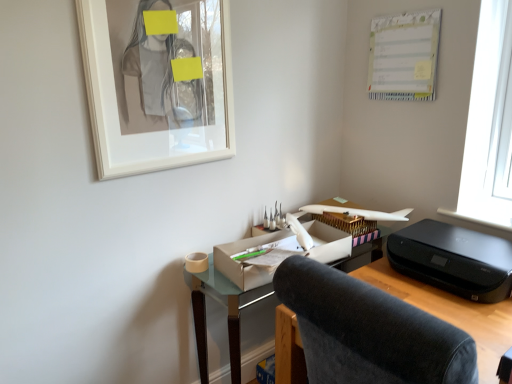
The height and width of the screenshot is (384, 512). What do you see at coordinates (404, 56) in the screenshot?
I see `white paperboard at upper right` at bounding box center [404, 56].

This screenshot has width=512, height=384. What do you see at coordinates (246, 265) in the screenshot? I see `matte cardboard box at center` at bounding box center [246, 265].

The height and width of the screenshot is (384, 512). Describe the element at coordinates (158, 83) in the screenshot. I see `white glossy picture frame at upper left` at that location.

Locate an element on the screen. This screenshot has height=384, width=512. matte cardboard desk at center is located at coordinates (227, 315).

What do you see at coordinates (369, 331) in the screenshot? This screenshot has width=512, height=384. I see `velvet dark gray chair at center` at bounding box center [369, 331].

Locate an element on the screen. Image resolution: width=512 pixels, height=384 pixels. black plastic printer at right is located at coordinates (453, 260).

Identify the location of white paperboard at upper right. (404, 56).

Which is in front, point (230, 131) or point (396, 234)?

The point (396, 234) is more forward.

Looking at this image, is white glossy picture frame at upper left completely or partially outside of black plastic printer at right?

Yes.

Is white glossy picture frame at upper left looking in the opposite direction of black plastic printer at right?

That's not correct — white glossy picture frame at upper left is not looking away from black plastic printer at right.

Are white glossy picture frame at upper left and black plastic printer at right located far from each other?

Absolutely, white glossy picture frame at upper left is distant from black plastic printer at right.

Find the location of a particular element. The image size is (512, 384). bulletin board behind the white glossy picture frame at upper left is located at coordinates (404, 56).

How much distance is there between white glossy picture frame at upper left and white paperboard at upper right?

white glossy picture frame at upper left is 36.29 inches away from white paperboard at upper right.

Considering the sizes of white glossy picture frame at upper left and white paperboard at upper right in the image, is white glossy picture frame at upper left bigger or smaller than white paperboard at upper right?

In the image, white glossy picture frame at upper left appears to be larger than white paperboard at upper right.

How distant is white glossy picture frame at upper left from matte cardboard box at center?

64.30 centimeters.

In terms of size, does white glossy picture frame at upper left appear bigger or smaller than matte cardboard box at center?

In the image, white glossy picture frame at upper left appears to be smaller than matte cardboard box at center.

Is white glossy picture frame at upper left to the right of matte cardboard box at center from the viewer's perspective?

No, white glossy picture frame at upper left is not to the right of matte cardboard box at center.

Between white glossy picture frame at upper left and matte cardboard box at center, which one has less height?

matte cardboard box at center is shorter.

Which of these two, matte cardboard box at center or black plastic printer at right, stands shorter?

With less height is matte cardboard box at center.

From the image's perspective, would you say matte cardboard box at center is positioned over black plastic printer at right?

Yes, from the image's perspective, matte cardboard box at center is on top of black plastic printer at right.

In the scene shown: In the image, is matte cardboard box at center on the left side or the right side of black plastic printer at right?

Clearly, matte cardboard box at center is on the left of black plastic printer at right in the image.

What's the angular difference between matte cardboard box at center and black plastic printer at right's facing directions?

They differ by 84.6 degrees in their facing directions.

Based on the photo, is matte cardboard desk at center far from white glossy picture frame at upper left?

Actually, matte cardboard desk at center and white glossy picture frame at upper left are a little close together.

Is matte cardboard desk at center at the right side of white glossy picture frame at upper left?

Yes, matte cardboard desk at center is to the right of white glossy picture frame at upper left.

From a real-world perspective, is matte cardboard desk at center above or below white glossy picture frame at upper left?

Clearly, from a real-world perspective, matte cardboard desk at center is below white glossy picture frame at upper left.

Who is taller, matte cardboard desk at center or white glossy picture frame at upper left?

Standing taller between the two is matte cardboard desk at center.

Is point (285, 236) closer or farther from the camera than point (204, 302)?

Point (285, 236) appears to be closer to the viewer than point (204, 302).

From the image's perspective, is matte cardboard box at center located beneath matte cardboard desk at center?

Actually, matte cardboard box at center appears above matte cardboard desk at center in the image.

Relative to matte cardboard desk at center, is matte cardboard box at center in front or behind?

matte cardboard box at center is in front of matte cardboard desk at center.

Locate an element on the screen. The width and height of the screenshot is (512, 384). desk beneath the matte cardboard box at center (from a real-world perspective) is located at coordinates [x=227, y=315].

From a real-world perspective, is black plastic printer at right over white glossy picture frame at upper left?

Actually, black plastic printer at right is physically below white glossy picture frame at upper left in the real world.

Is black plastic printer at right not inside white glossy picture frame at upper left?

Yes.

Can you confirm if black plastic printer at right is bigger than white glossy picture frame at upper left?

Yes, black plastic printer at right is bigger than white glossy picture frame at upper left.

Locate an element on the screen. picture frame that is above the black plastic printer at right (from a real-world perspective) is located at coordinates (158, 83).

You are a GUI agent. You are given a task and a screenshot of the screen. Output one action in this format:
    pyautogui.click(x=<x>, y=<y>)
    Task: Click on the bulletin board above the white glossy picture frame at upper left (from the image's perspective)
    
    Given the screenshot: What is the action you would take?
    pyautogui.click(x=404, y=56)

Estimate the real-world distances between objects in this image. Which object is closer to white paperboard at upper right, black plastic printer at right or matte cardboard box at center?

Based on the image, black plastic printer at right appears to be nearer to white paperboard at upper right.

Which object lies nearer to the anchor point white paperboard at upper right, matte cardboard box at center or matte cardboard desk at center?

The object closer to white paperboard at upper right is matte cardboard box at center.

Looking at the image, which one is located further to velvet dark gray chair at center, matte cardboard box at center or matte cardboard desk at center?

matte cardboard desk at center is further to velvet dark gray chair at center.

Looking at the image, which one is located closer to velvet dark gray chair at center, matte cardboard box at center or black plastic printer at right?

Based on the image, matte cardboard box at center appears to be nearer to velvet dark gray chair at center.

From the image, which object appears to be farther from white glossy picture frame at upper left, white paperboard at upper right or matte cardboard box at center?

white paperboard at upper right is positioned further to the anchor white glossy picture frame at upper left.

Which object lies nearer to the anchor point matte cardboard desk at center, matte cardboard box at center or velvet dark gray chair at center?

matte cardboard box at center.

Considering their positions, is white paperboard at upper right positioned closer to velvet dark gray chair at center than white glossy picture frame at upper left?

white glossy picture frame at upper left is closer to velvet dark gray chair at center.

Based on their spatial positions, is matte cardboard box at center or white glossy picture frame at upper left closer to black plastic printer at right?

The object closer to black plastic printer at right is matte cardboard box at center.

You are a GUI agent. You are given a task and a screenshot of the screen. Output one action in this format:
    pyautogui.click(x=<x>, y=<y>)
    Task: Click on the picture frame that lies between white paperboard at upper right and matte cardboard desk at center from top to bottom
    The height and width of the screenshot is (384, 512).
    Given the screenshot: What is the action you would take?
    pyautogui.click(x=158, y=83)

This screenshot has height=384, width=512. Identify the location of office supplies between velvet dark gray chair at center and white paperboard at upper right along the z-axis. (246, 265).

Identify the location of printer between velvet dark gray chair at center and matte cardboard box at center along the z-axis. The width and height of the screenshot is (512, 384). (453, 260).

I want to click on office supplies that lies between white paperboard at upper right and black plastic printer at right from top to bottom, so click(x=246, y=265).